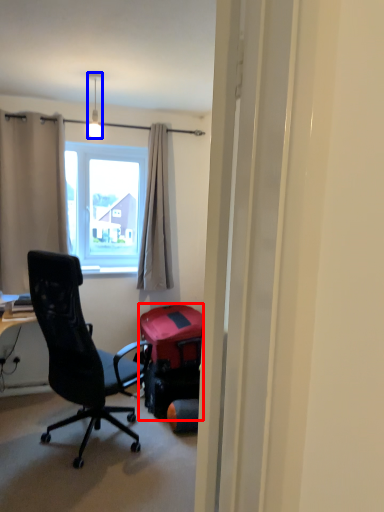
Question: Which object appears farthest to the camera in this image, luggage and bags (highlighted by a red box) or lamp (highlighted by a blue box)?

Choices:
 (A) luggage and bags
 (B) lamp

Answer: (A)